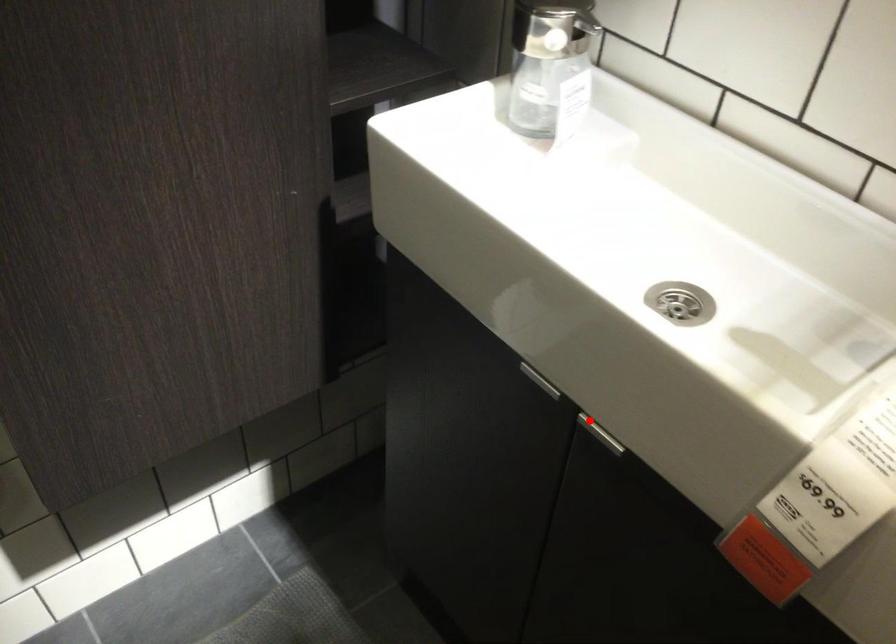
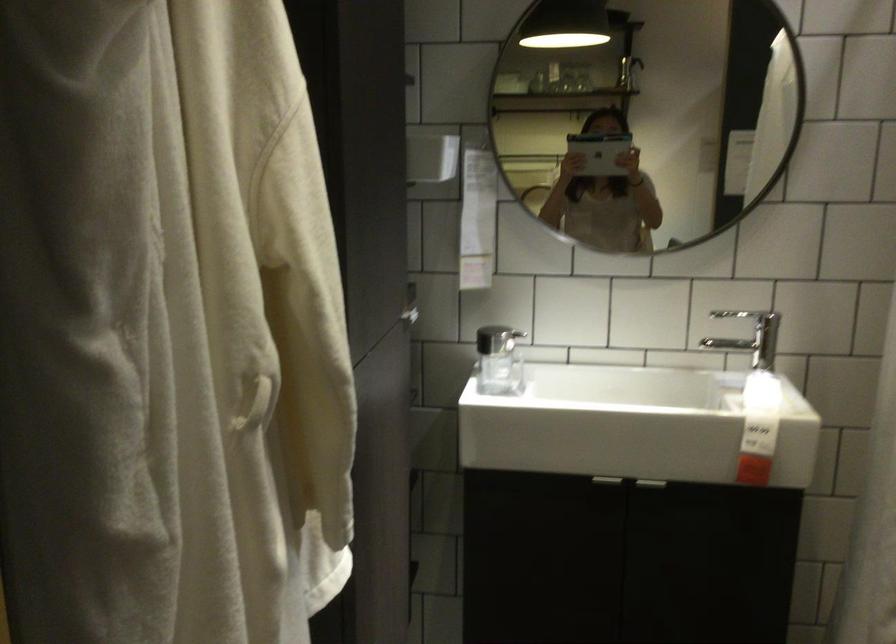
The point at the highlighted location is marked in the first image. Where is the corresponding point in the second image?

(650, 484)